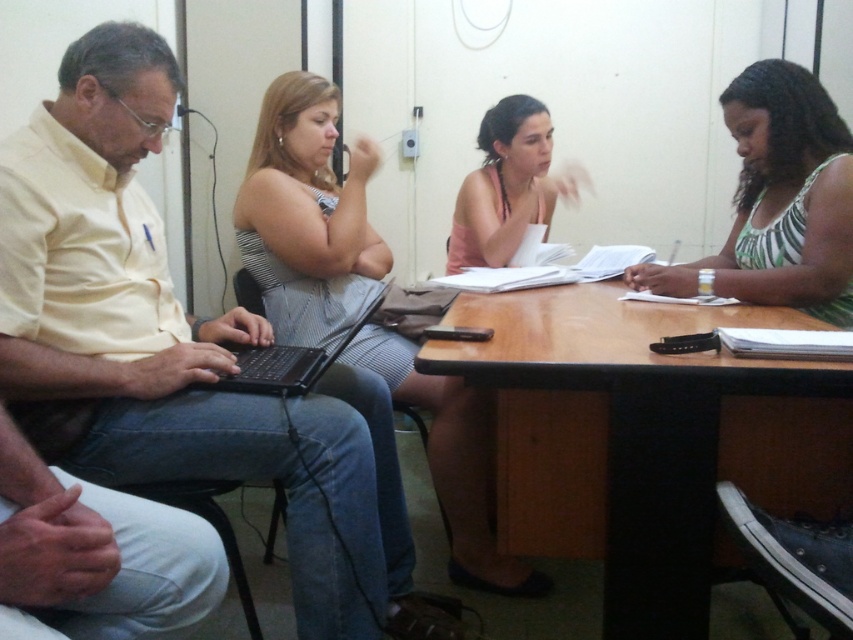
Question: Which object appears farthest from the camera in this image?

Choices:
 (A) green striped tank top at right
 (B) striped fabric dress at center
 (C) yellow matte shirt at left

Answer: (B)

Question: Does green striped tank top at right have a larger size compared to black plastic laptop at left?

Choices:
 (A) no
 (B) yes

Answer: (B)

Question: Can you confirm if yellow matte shirt at left is thinner than brown wood table at center?

Choices:
 (A) no
 (B) yes

Answer: (B)

Question: Which point appears farthest from the camera in this image?

Choices:
 (A) (405, 364)
 (B) (648, 406)

Answer: (A)

Question: Which object appears farthest from the camera in this image?

Choices:
 (A) green striped tank top at right
 (B) matte pink shirt at center
 (C) brown wood table at center

Answer: (B)

Question: Does striped fabric dress at center appear on the left side of black plastic laptop at left?

Choices:
 (A) no
 (B) yes

Answer: (A)